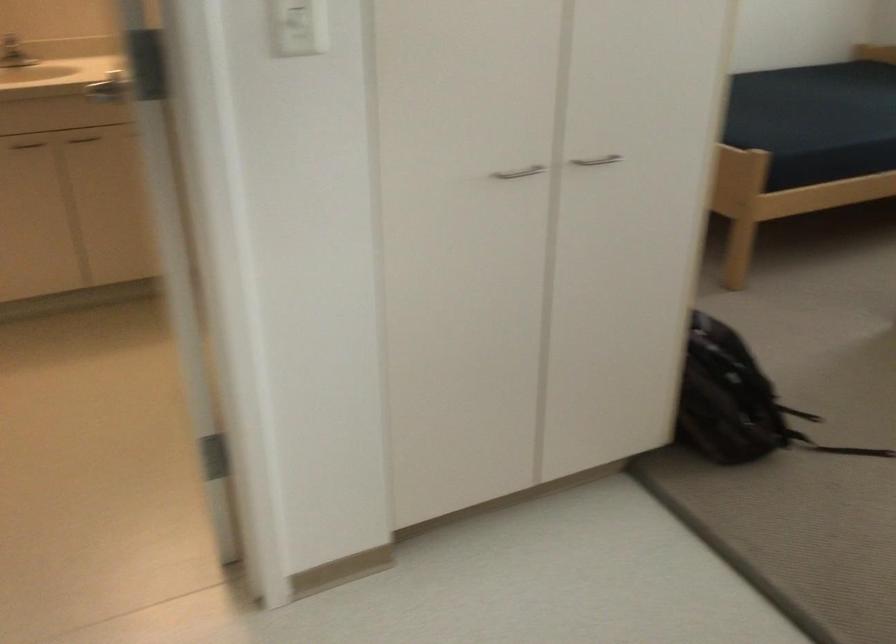
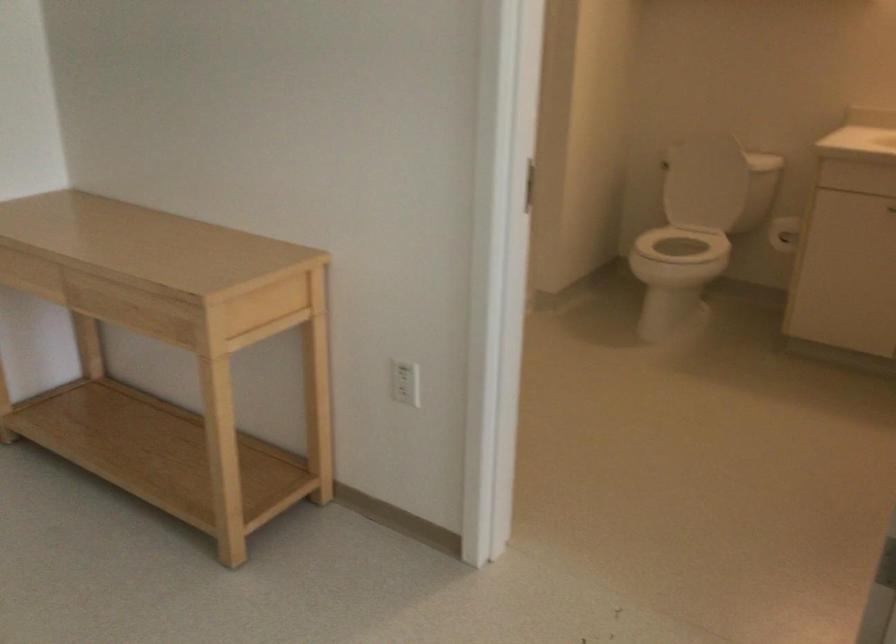
Question: Based on the continuous images, in which direction is the camera rotating? Reply with the corresponding letter.

Choices:
 (A) Left
 (B) Right
 (C) Up
 (D) Down

Answer: (A)